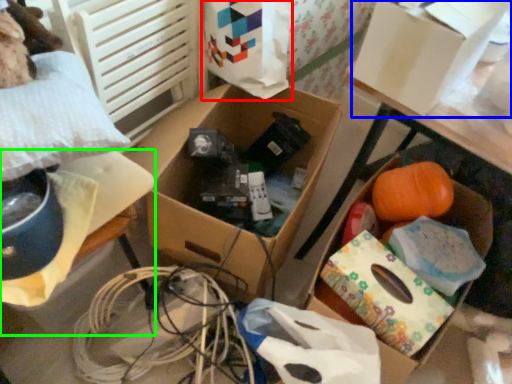
Question: Which is nearer to the shopping bag (highlighted by a red box)? storage box (highlighted by a blue box) or storage box (highlighted by a green box).

Choices:
 (A) storage box
 (B) storage box

Answer: (A)